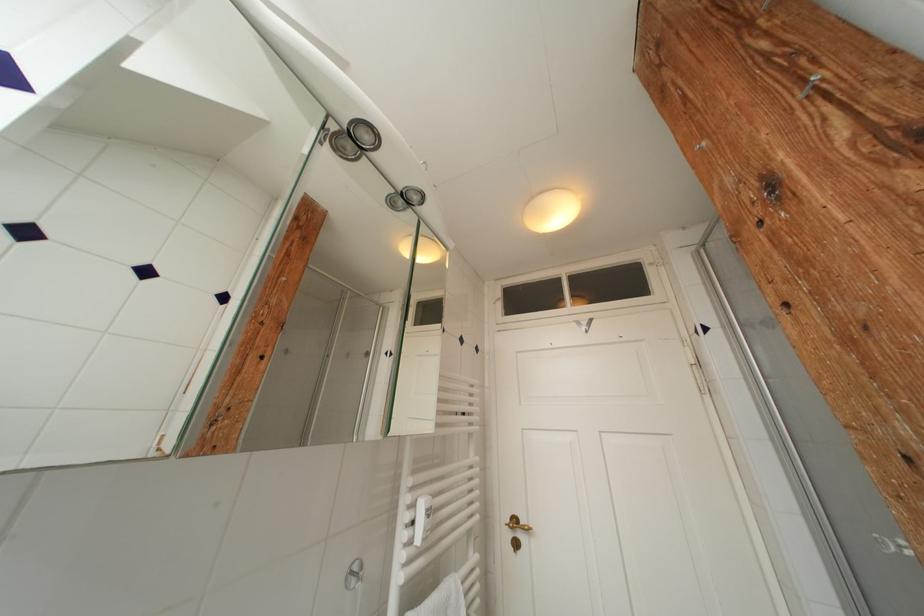
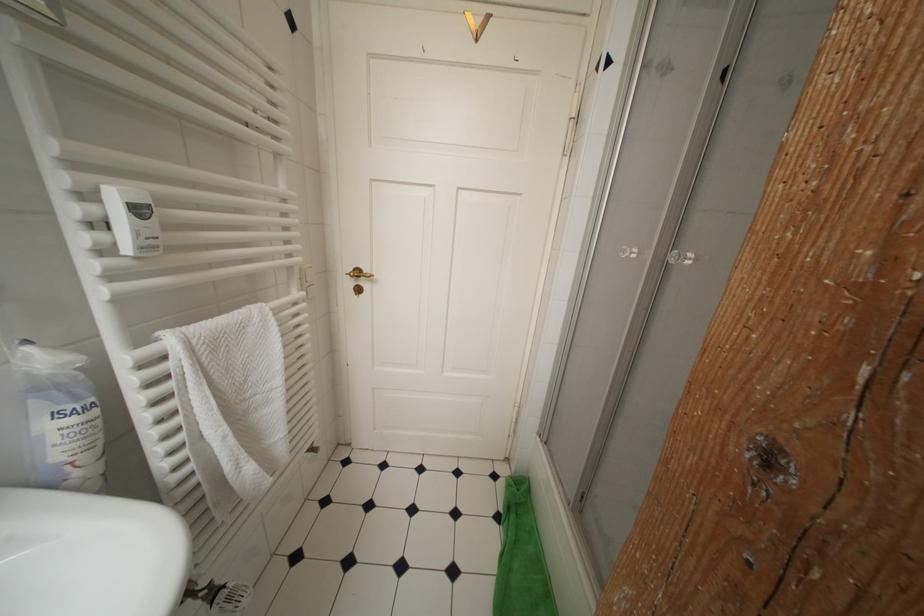
How did the camera likely rotate?

The camera's rotation is toward right-down.